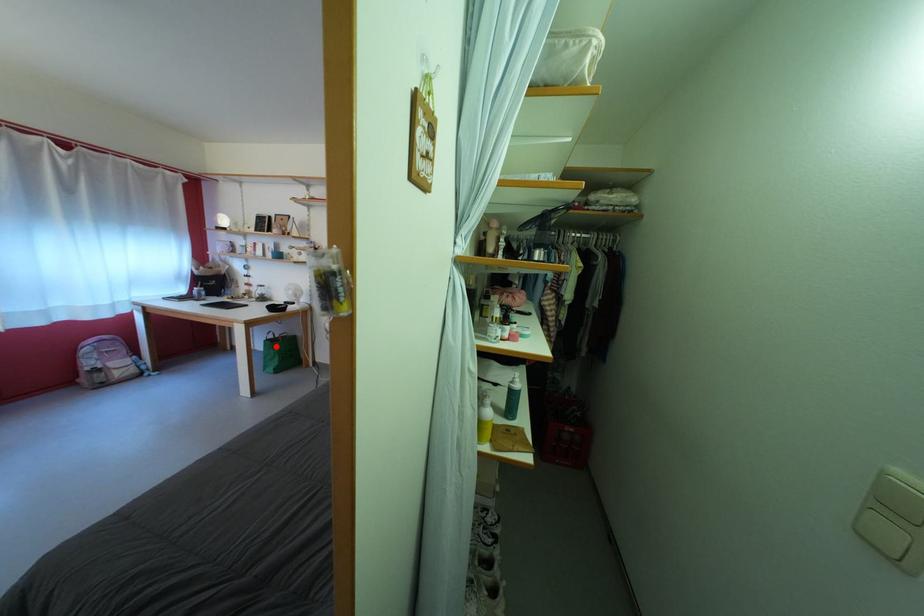
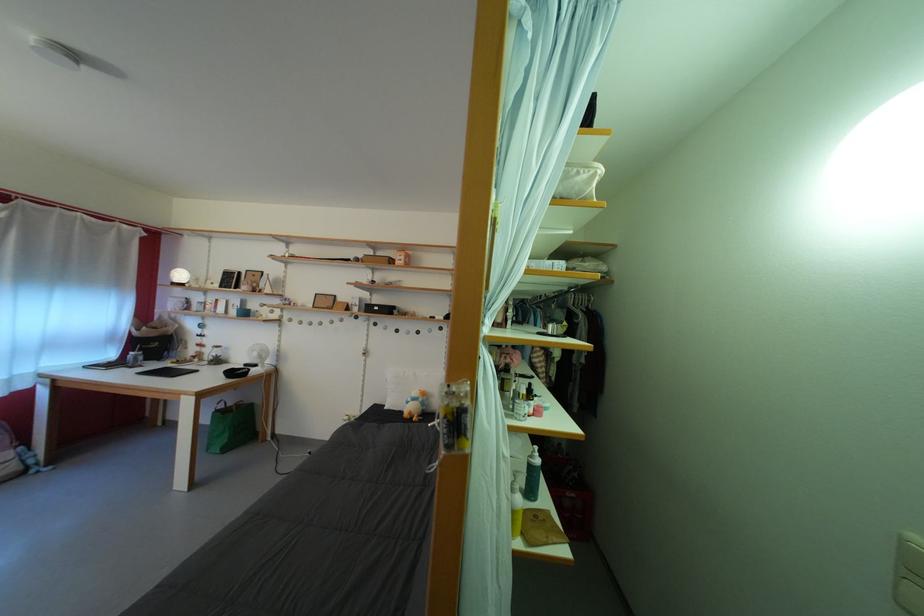
The point at the highlighted location is marked in the first image. Where is the corresponding point in the second image?

(225, 416)